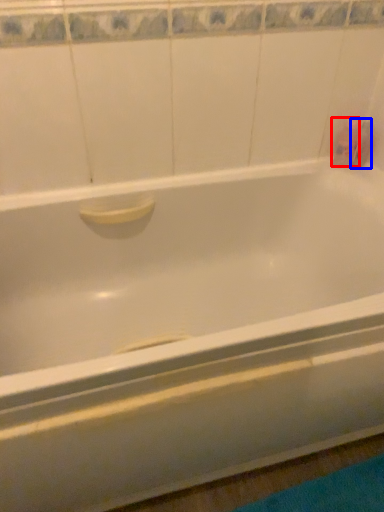
Question: Which object is closer to the camera taking this photo, toiletry (highlighted by a red box) or toiletry (highlighted by a blue box)?

Choices:
 (A) toiletry
 (B) toiletry

Answer: (A)